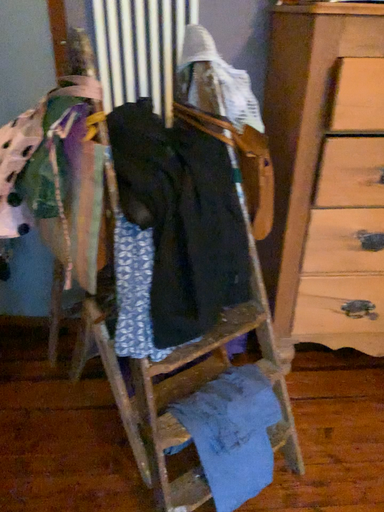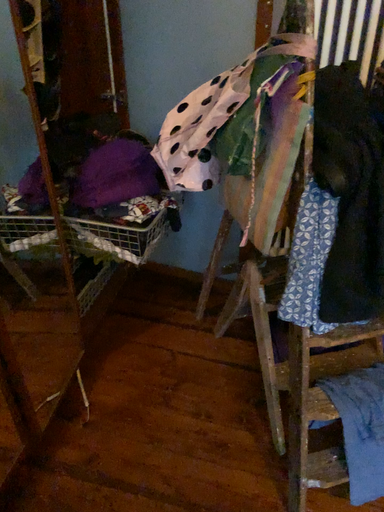
Question: Which way did the camera rotate in the video?

Choices:
 (A) rotated left
 (B) rotated right

Answer: (A)